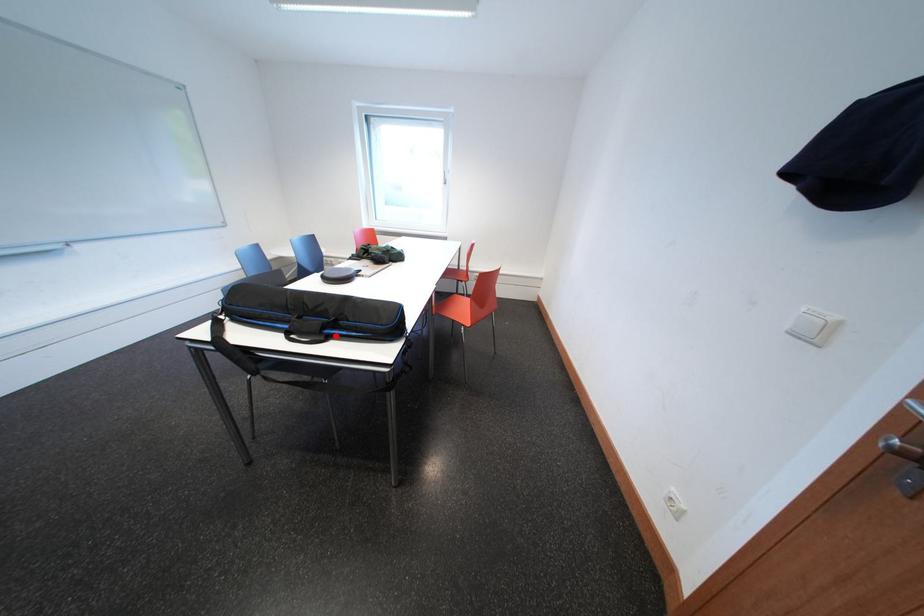
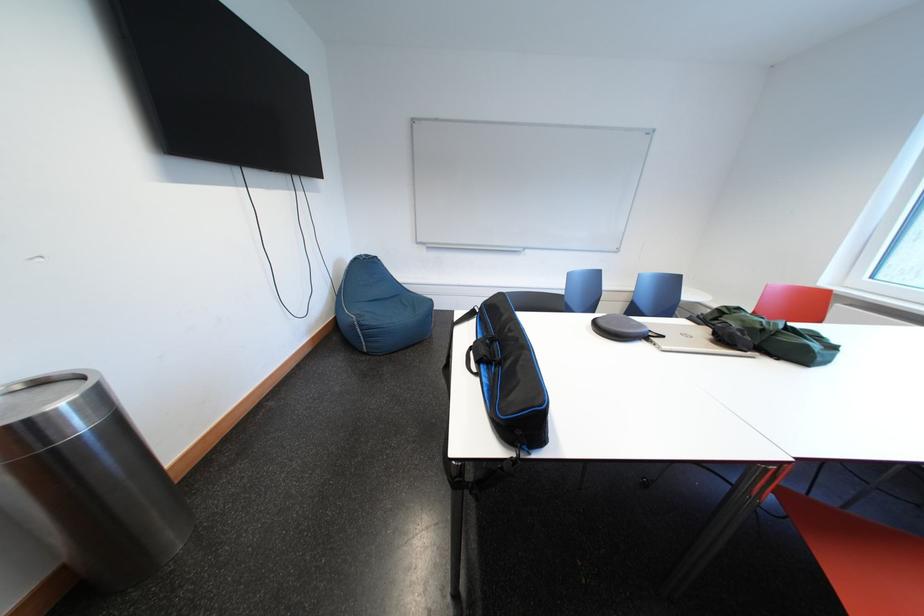
Find the pixel in the second image that matches the highlighted location in the first image.

(492, 371)